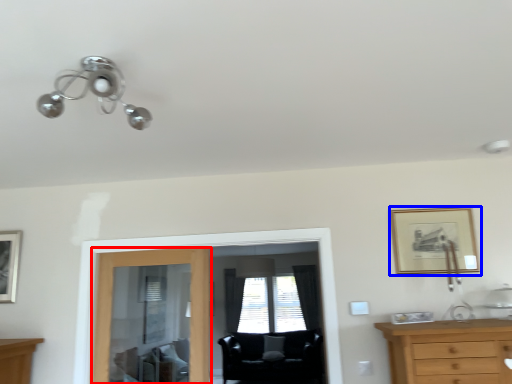
Question: Which object appears farthest to the camera in this image, door (highlighted by a red box) or picture frame (highlighted by a blue box)?

Choices:
 (A) door
 (B) picture frame

Answer: (A)